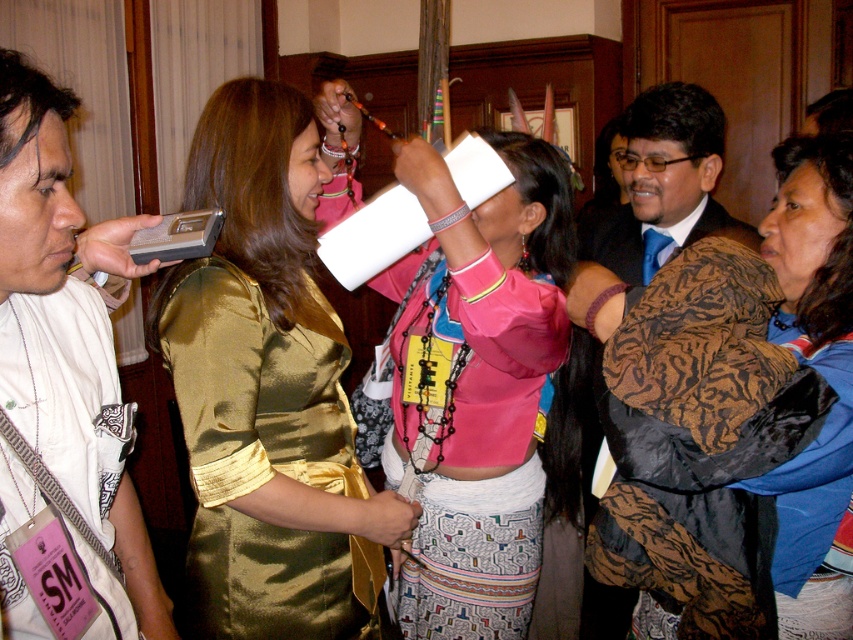
You are at the point labeled point (x=840, y=275) and want to walk towards the door located at point (x=318, y=570). Will you have a clear path without obstacles?

Point (x=840, y=275) is in front of point (x=318, y=570), so you will have a clear path without obstacles when walking towards the door.

You are attending a formal event and notice two attendees wearing the gold satin dress at center and the pink satin blouse at center. Which one is lower in position compared to the other?

The gold satin dress at center is positioned under the pink satin blouse at center, so it is lower in position.